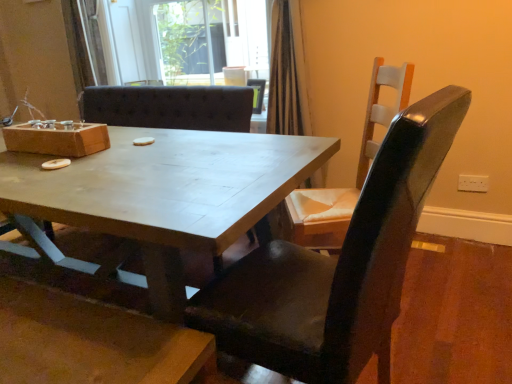
Identify the location of vacant area that lies to the right of wooden box at upper left. The width and height of the screenshot is (512, 384). (121, 155).